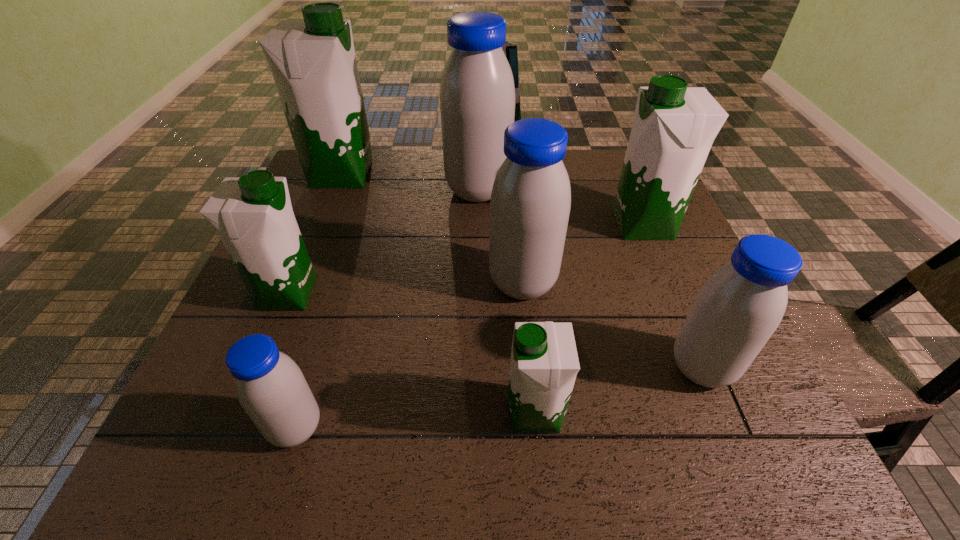
Locate an element on the screen. This screenshot has height=540, width=960. the leftmost blue soya milk is located at coordinates 271,388.

You are a GUI agent. You are given a task and a screenshot of the screen. Output one action in this format:
    pyautogui.click(x=<x>, y=<y>)
    Task: Click on the smallest blue soya milk
    The image size is (960, 540).
    Given the screenshot: What is the action you would take?
    pyautogui.click(x=271, y=388)

Where is `vacant point located on the front-facing side of the biggest green soya milk`? This screenshot has width=960, height=540. vacant point located on the front-facing side of the biggest green soya milk is located at coordinates (401, 174).

Where is `blank area located on the left of the biggest blue soya milk`? This screenshot has height=540, width=960. blank area located on the left of the biggest blue soya milk is located at coordinates (314, 191).

Identify the location of vacant space located 0.150m on the front-facing side of the rightmost green soya milk. (554, 225).

You are a GUI agent. You are given a task and a screenshot of the screen. Output one action in this format:
    pyautogui.click(x=<x>, y=<y>)
    Task: Click on the vacant region located 0.190m on the front-facing side of the rightmost green soya milk
    
    Given the screenshot: What is the action you would take?
    pyautogui.click(x=539, y=225)

Where is `vacant space located 0.170m on the front-facing side of the rightmost green soya milk`? The height and width of the screenshot is (540, 960). vacant space located 0.170m on the front-facing side of the rightmost green soya milk is located at coordinates click(x=546, y=225).

Where is `free space located 0.070m on the left of the second biggest blue soya milk`? Image resolution: width=960 pixels, height=540 pixels. free space located 0.070m on the left of the second biggest blue soya milk is located at coordinates (458, 283).

Find the location of `vacant position located 0.310m on the front-facing side of the third biggest green soya milk`. vacant position located 0.310m on the front-facing side of the third biggest green soya milk is located at coordinates coord(456,294).

Image resolution: width=960 pixels, height=540 pixels. Find the location of `vacant space located on the back of the second nearest blue soya milk`. vacant space located on the back of the second nearest blue soya milk is located at coordinates (677, 308).